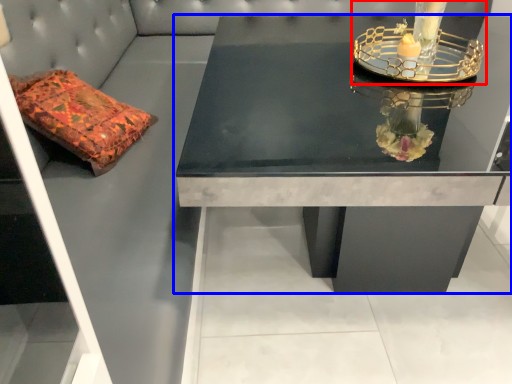
Question: Among these objects, which one is nearest to the camera, candle holder (highlighted by a red box) or table (highlighted by a blue box)?

Choices:
 (A) candle holder
 (B) table

Answer: (B)